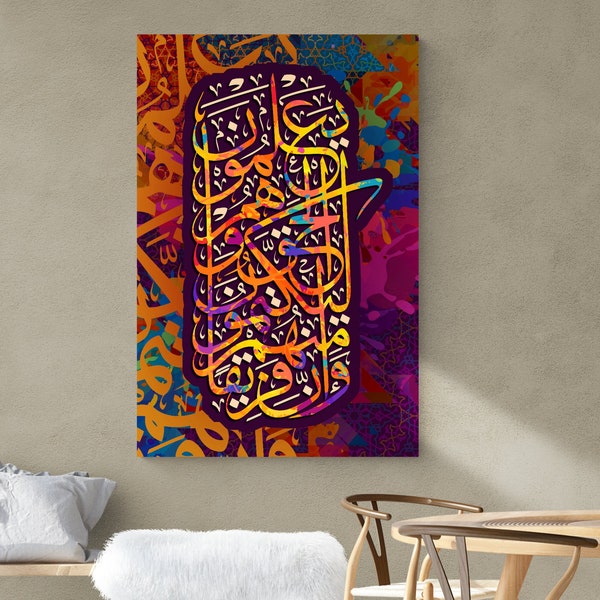
The height and width of the screenshot is (600, 600). Identify the location of artwork corner. (408, 445), (147, 447), (142, 45), (410, 44).